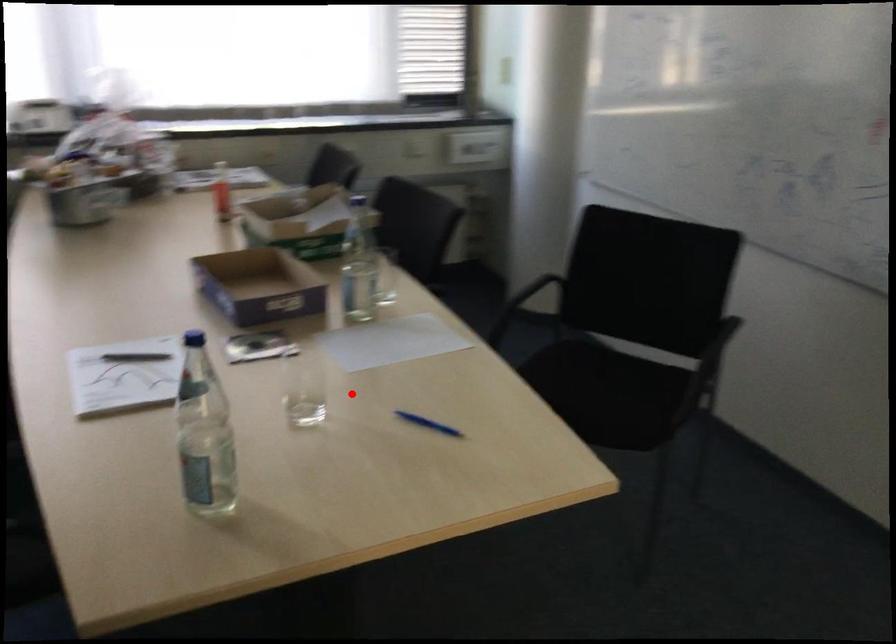
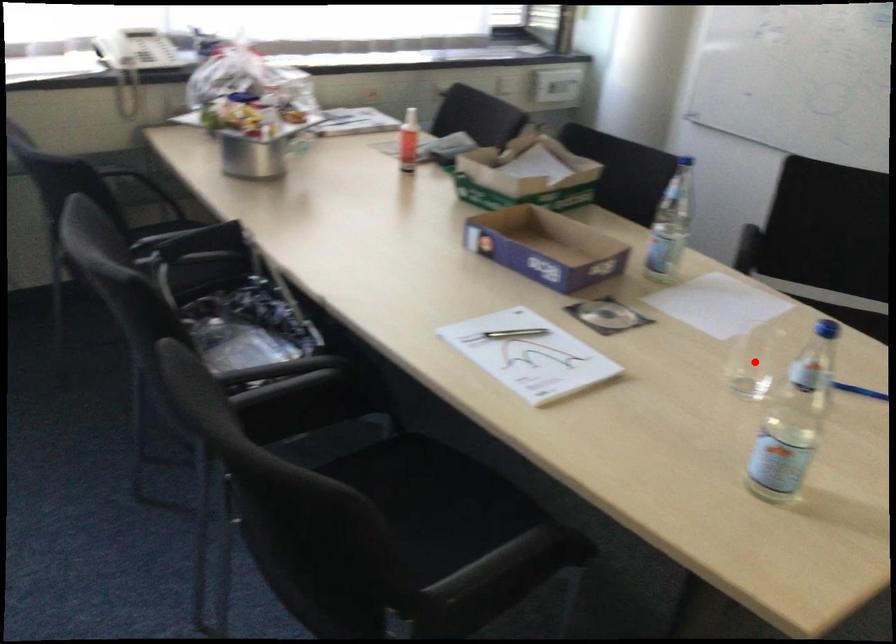
I am providing you with two images of the same scene from different viewpoints. A red point is marked on the first image and another point is marked on the second image. Are the points marked in image1 and image2 representing the same 3D position?

Yes